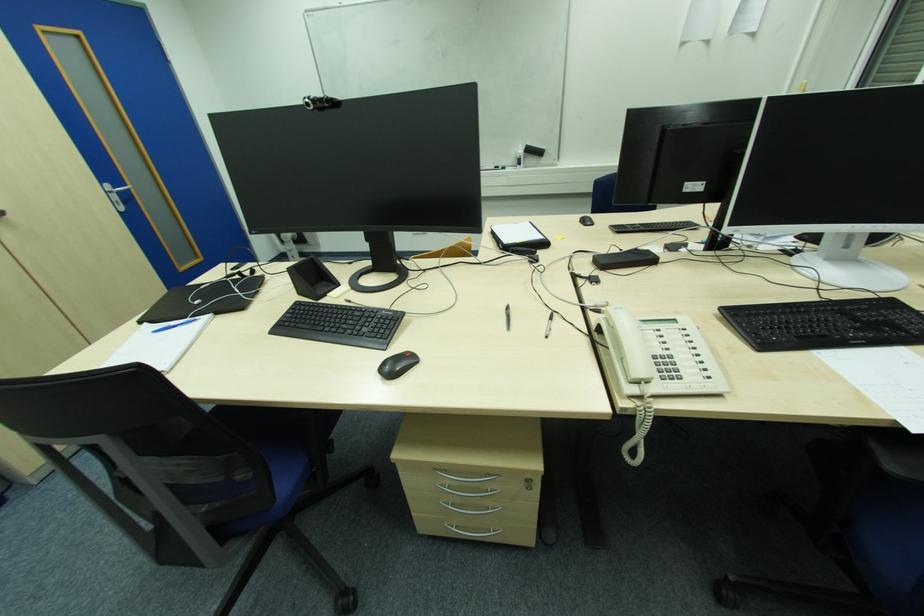
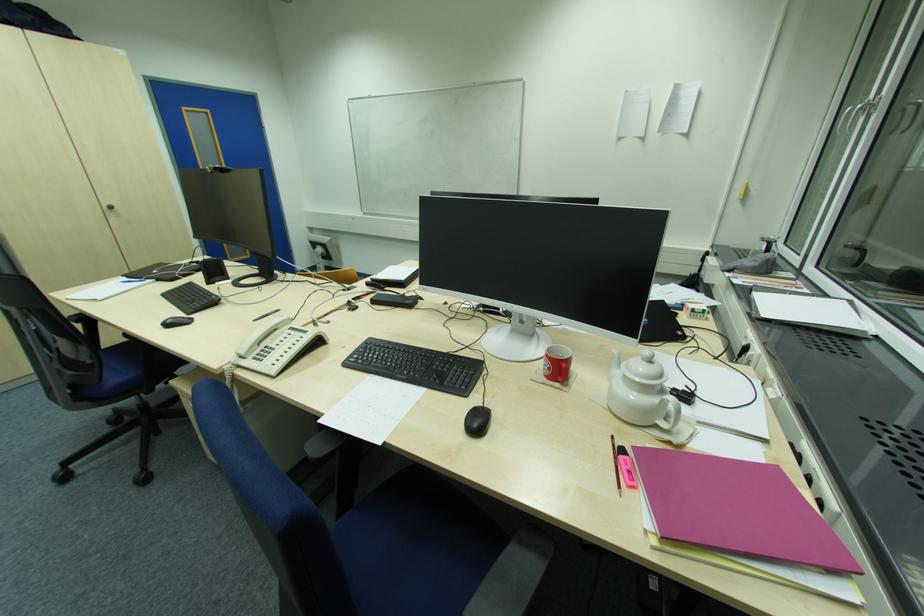
Question: What movement of the cameraman would produce the second image?

Choices:
 (A) Left
 (B) Right
 (C) Forward
 (D) Backward

Answer: (B)